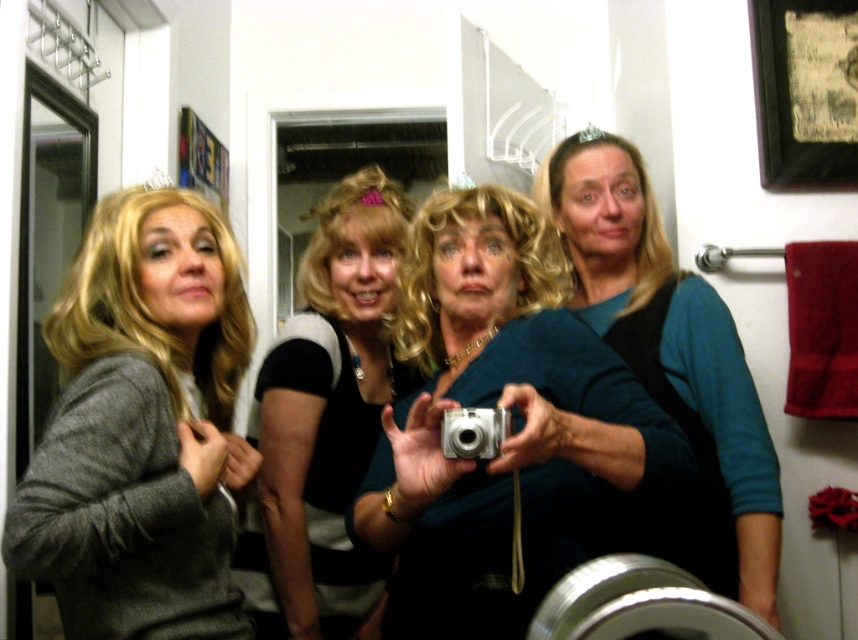
You are taking a photo of the women in the bathroom. The teal fabric top at center and the silver metallic camera at center are both in your view. Which object is closer to the camera lens?

The teal fabric top at center is positioned over the silver metallic camera at center, so the teal fabric top at center is closer to the camera lens.

You are taking a photo of the four women in the bathroom scene. The metallic silver camera at center and the teal fabric top at center are both in your view. Which object is positioned to the left?

The metallic silver camera at center is to the left of the teal fabric top at center, so the metallic silver camera at center is positioned to the left.